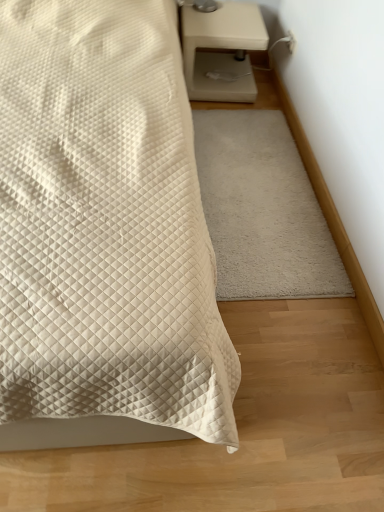
What do you see at coordinates (104, 234) in the screenshot?
I see `white quilted bed at center` at bounding box center [104, 234].

The image size is (384, 512). Describe the element at coordinates (221, 49) in the screenshot. I see `beige matte nightstand at upper right` at that location.

Where is `white soft rug at center`? This screenshot has width=384, height=512. white soft rug at center is located at coordinates (x=263, y=210).

Does white soft rug at center have a greater width compared to white quilted bed at center?

Incorrect, the width of white soft rug at center does not surpass that of white quilted bed at center.

Is white soft rug at center oriented towards white quilted bed at center?

No.

Is white soft rug at center beside white quilted bed at center?

white soft rug at center is not next to white quilted bed at center, and they're not touching.

From the picture: Is white soft rug at center located outside white quilted bed at center?

Yes, white soft rug at center is located beyond the bounds of white quilted bed at center.

Does beige matte nightstand at upper right appear on the left side of white soft rug at center?

Correct, you'll find beige matte nightstand at upper right to the left of white soft rug at center.

Find the location of a particular element. This screenshot has height=512, width=384. mat below the beige matte nightstand at upper right (from a real-world perspective) is located at coordinates (263, 210).

Which is correct: beige matte nightstand at upper right is inside white soft rug at center, or outside of it?

beige matte nightstand at upper right is not enclosed by white soft rug at center.

Considering the sizes of objects beige matte nightstand at upper right and white soft rug at center in the image provided, who is shorter, beige matte nightstand at upper right or white soft rug at center?

white soft rug at center is shorter.

Is the position of white quilted bed at center less distant than that of beige matte nightstand at upper right?

Yes, white quilted bed at center is closer to the camera.

From the image's perspective, who appears lower, white quilted bed at center or beige matte nightstand at upper right?

white quilted bed at center is shown below in the image.

Is white quilted bed at center positioned with its back to beige matte nightstand at upper right?

No, white quilted bed at center is not facing away from beige matte nightstand at upper right.

You are a GUI agent. You are given a task and a screenshot of the screen. Output one action in this format:
    pyautogui.click(x=<x>, y=<y>)
    Task: Click on the mat that is on the right side of beige matte nightstand at upper right
    This screenshot has width=384, height=512.
    Given the screenshot: What is the action you would take?
    pyautogui.click(x=263, y=210)

Is white soft rug at center touching beige matte nightstand at upper right?

white soft rug at center is not next to beige matte nightstand at upper right, and they're not touching.

From a real-world perspective, is white soft rug at center physically below beige matte nightstand at upper right?

Result: Yes.

Considering the sizes of objects white soft rug at center and beige matte nightstand at upper right in the image provided, who is taller, white soft rug at center or beige matte nightstand at upper right?

With more height is beige matte nightstand at upper right.

Which point is more forward, (228, 55) or (7, 293)?

The point (7, 293) is more forward.

Is beige matte nightstand at upper right positioned with its back to white quilted bed at center?

No, beige matte nightstand at upper right's orientation is not away from white quilted bed at center.

Does beige matte nightstand at upper right have a lesser width compared to white quilted bed at center?

Yes, beige matte nightstand at upper right is thinner than white quilted bed at center.

Is beige matte nightstand at upper right further to the viewer compared to white quilted bed at center?

Yes, beige matte nightstand at upper right is further from the viewer.

Is white quilted bed at center in front of white soft rug at center?

Yes, the depth of white quilted bed at center is less than that of white soft rug at center.

Considering the sizes of objects white quilted bed at center and white soft rug at center in the image provided, who is thinner, white quilted bed at center or white soft rug at center?

white soft rug at center.

The height and width of the screenshot is (512, 384). Find the location of `bed to the left of white soft rug at center`. bed to the left of white soft rug at center is located at coordinates (104, 234).

Is white quilted bed at center oriented away from white soft rug at center?

No, white quilted bed at center is not facing away from white soft rug at center.

You are a GUI agent. You are given a task and a screenshot of the screen. Output one action in this format:
    pyautogui.click(x=<x>, y=<y>)
    Task: Click on the mat below the white quilted bed at center (from a real-world perspective)
    The height and width of the screenshot is (512, 384).
    Given the screenshot: What is the action you would take?
    pyautogui.click(x=263, y=210)

This screenshot has height=512, width=384. In order to click on nightstand above the white soft rug at center (from a real-world perspective) in this screenshot , I will do `click(221, 49)`.

From the image, which object appears to be farther from white soft rug at center, beige matte nightstand at upper right or white quilted bed at center?

The object further to white soft rug at center is white quilted bed at center.

Which object lies nearer to the anchor point white quilted bed at center, beige matte nightstand at upper right or white soft rug at center?

Based on the image, white soft rug at center appears to be nearer to white quilted bed at center.

Estimate the real-world distances between objects in this image. Which object is closer to beige matte nightstand at upper right, white soft rug at center or white quilted bed at center?

white soft rug at center.

Estimate the real-world distances between objects in this image. Which object is closer to white quilted bed at center, white soft rug at center or beige matte nightstand at upper right?

Among the two, white soft rug at center is located nearer to white quilted bed at center.

Considering their positions, is white quilted bed at center positioned closer to white soft rug at center than beige matte nightstand at upper right?

beige matte nightstand at upper right is positioned closer to the anchor white soft rug at center.

Estimate the real-world distances between objects in this image. Which object is further from beige matte nightstand at upper right, white quilted bed at center or white soft rug at center?

Based on the image, white quilted bed at center appears to be further to beige matte nightstand at upper right.

Identify the location of mat between white quilted bed at center and beige matte nightstand at upper right from front to back. This screenshot has width=384, height=512. (263, 210).